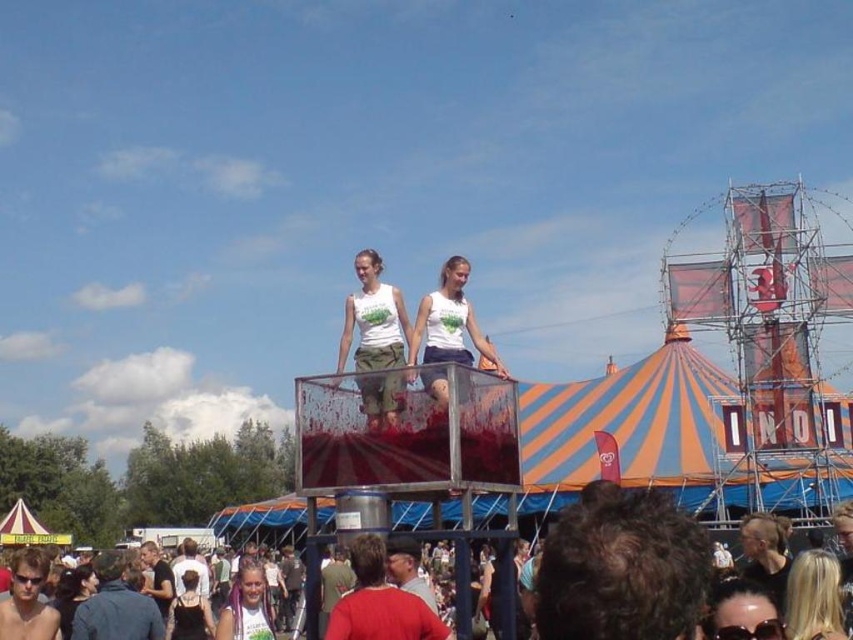
Between matte white tank tops at center and blonde hair at lower right, which one has more height?

Standing taller between the two is matte white tank tops at center.

This screenshot has width=853, height=640. Identify the location of matte white tank tops at center. coord(634,588).

Is blonde hair at lower right behind black leather dress at lower center?

No, blonde hair at lower right is closer to the viewer.

Can you confirm if blonde hair at lower right is thinner than black leather dress at lower center?

Correct, blonde hair at lower right's width is less than black leather dress at lower center's.

You are a GUI agent. You are given a task and a screenshot of the screen. Output one action in this format:
    pyautogui.click(x=<x>, y=<y>)
    Task: Click on the blonde hair at lower right
    This screenshot has width=853, height=640.
    Given the screenshot: What is the action you would take?
    pyautogui.click(x=813, y=596)

Does point (383, 304) come behind point (820, 627)?

Yes.

Who is taller, white cotton tank top at center or blonde hair at lower right?

white cotton tank top at center is taller.

Where is `white cotton tank top at center`? The width and height of the screenshot is (853, 640). white cotton tank top at center is located at coordinates (373, 320).

The image size is (853, 640). Identify the location of white cotton tank top at center. (373, 320).